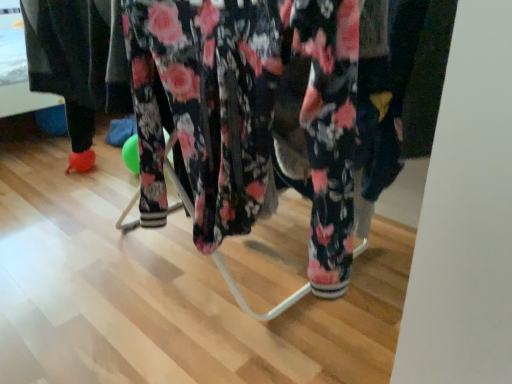
Question: Should I look upward or downward to see floral fabric pants at center?

Choices:
 (A) down
 (B) up

Answer: (B)